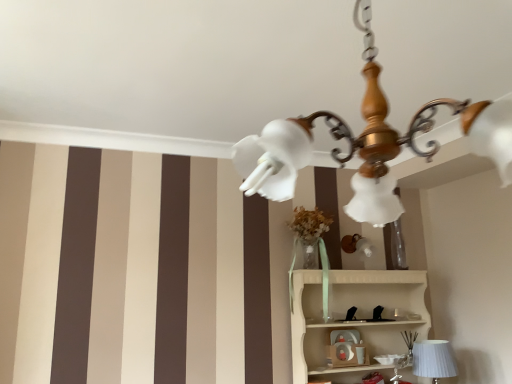
Locate an element on the screen. white ribbed fabric at lower right is located at coordinates (434, 359).

Where is `matte plastic toy at center`? matte plastic toy at center is located at coordinates (346, 349).

Image resolution: width=512 pixels, height=384 pixels. What do you see at coordinates (346, 349) in the screenshot? I see `matte plastic toy at center` at bounding box center [346, 349].

Measure the distance between point (362, 276) and camera.

Point (362, 276) and camera are 8.91 feet apart from each other.

The image size is (512, 384). Identify the location of white ribbed fabric at lower right. coord(434,359).

Consider the image. Is the surface of wooden chandelier at upper center in direct contact with white ribbed fabric at lower right?

No, wooden chandelier at upper center is not with white ribbed fabric at lower right.

Between wooden chandelier at upper center and white ribbed fabric at lower right, which one appears on the right side from the viewer's perspective?

white ribbed fabric at lower right is more to the right.

Is point (378, 142) closer to camera compared to point (422, 353)?

Yes, it is in front of point (422, 353).

Would you say wooden chandelier at upper center is outside white ribbed fabric at lower right?

Indeed, wooden chandelier at upper center is completely outside white ribbed fabric at lower right.

Locate an element on the screen. This screenshot has width=512, height=384. shelf on the right side of wooden chandelier at upper center is located at coordinates (357, 315).

From the image's perspective, is white wood shelf at lower right located beneath wooden chandelier at upper center?

Correct, white wood shelf at lower right appears lower than wooden chandelier at upper center in the image.

Is white wood shelf at lower right positioned beyond the bounds of wooden chandelier at upper center?

Absolutely, white wood shelf at lower right is external to wooden chandelier at upper center.

In terms of width, does white wood shelf at lower right look wider or thinner when compared to wooden chandelier at upper center?

Considering their sizes, white wood shelf at lower right looks slimmer than wooden chandelier at upper center.

Could you tell me if wooden chandelier at upper center is turned towards white wood shelf at lower right?

No, wooden chandelier at upper center does not turn towards white wood shelf at lower right.

Is wooden chandelier at upper center outside of white wood shelf at lower right?

Yes, wooden chandelier at upper center is not within white wood shelf at lower right.

From the image's perspective, which is above, wooden chandelier at upper center or white wood shelf at lower right?

wooden chandelier at upper center.

Between wooden chandelier at upper center and white wood shelf at lower right, which one has less height?

wooden chandelier at upper center is shorter.

Is white ribbed fabric at lower right turned away from white wood shelf at lower right?

Yes.

Does white ribbed fabric at lower right have a greater width compared to white wood shelf at lower right?

No, white ribbed fabric at lower right is not wider than white wood shelf at lower right.

From a real-world perspective, is white ribbed fabric at lower right above or below white wood shelf at lower right?

white ribbed fabric at lower right is below white wood shelf at lower right.

Based on the photo, between white ribbed fabric at lower right and white wood shelf at lower right, which one appears on the right side from the viewer's perspective?

white ribbed fabric at lower right.

Is white ribbed fabric at lower right taller than wooden chandelier at upper center?

No, white ribbed fabric at lower right is not taller than wooden chandelier at upper center.

Considering the relative positions of white ribbed fabric at lower right and wooden chandelier at upper center in the image provided, is white ribbed fabric at lower right to the left or to the right of wooden chandelier at upper center?

In the image, white ribbed fabric at lower right appears on the right side of wooden chandelier at upper center.

Do you think white ribbed fabric at lower right is within wooden chandelier at upper center, or outside of it?

white ribbed fabric at lower right is not inside wooden chandelier at upper center, it's outside.

The image size is (512, 384). Identify the location of lamp above the white ribbed fabric at lower right (from the image's perspective). (368, 142).

Considering the positions of objects matte plastic toy at center and white wood shelf at lower right in the image provided, who is more to the left, matte plastic toy at center or white wood shelf at lower right?

Positioned to the left is matte plastic toy at center.

Can you confirm if matte plastic toy at center is shorter than white wood shelf at lower right?

Correct, matte plastic toy at center is not as tall as white wood shelf at lower right.

From the image's perspective, is matte plastic toy at center above or below white wood shelf at lower right?

From the image's perspective, matte plastic toy at center appears below white wood shelf at lower right.

Which is closer to the camera, (370, 186) or (356, 332)?

Positioned in front is point (370, 186).

Considering the sizes of objects wooden chandelier at upper center and matte plastic toy at center in the image provided, who is taller, wooden chandelier at upper center or matte plastic toy at center?

With more height is wooden chandelier at upper center.

Could matte plastic toy at center be considered to be inside wooden chandelier at upper center?

Definitely not — matte plastic toy at center is not inside wooden chandelier at upper center.

From a real-world perspective, is wooden chandelier at upper center above or below matte plastic toy at center?

From a real-world perspective, wooden chandelier at upper center is physically above matte plastic toy at center.

You are a GUI agent. You are given a task and a screenshot of the screen. Output one action in this format:
    pyautogui.click(x=<x>, y=<y>)
    Task: Click on the lamp above the white ribbed fabric at lower right (from the image's perspective)
    
    Given the screenshot: What is the action you would take?
    pyautogui.click(x=368, y=142)

You are a GUI agent. You are given a task and a screenshot of the screen. Output one action in this format:
    pyautogui.click(x=<x>, y=<y>)
    Task: Click on the lamp in front of the white wood shelf at lower right
    
    Given the screenshot: What is the action you would take?
    pyautogui.click(x=368, y=142)

Considering their positions, is wooden chandelier at upper center positioned further to white ribbed fabric at lower right than matte plastic toy at center?

The object further to white ribbed fabric at lower right is wooden chandelier at upper center.

Considering their positions, is white wood shelf at lower right positioned further to wooden chandelier at upper center than white ribbed fabric at lower right?

The object further to wooden chandelier at upper center is white ribbed fabric at lower right.

When comparing their distances from white wood shelf at lower right, does matte plastic toy at center or white ribbed fabric at lower right seem closer?

matte plastic toy at center is closer to white wood shelf at lower right.

Considering their positions, is matte plastic toy at center positioned further to white wood shelf at lower right than wooden chandelier at upper center?

The object further to white wood shelf at lower right is wooden chandelier at upper center.

Considering their positions, is white ribbed fabric at lower right positioned further to wooden chandelier at upper center than matte plastic toy at center?

Based on the image, matte plastic toy at center appears to be further to wooden chandelier at upper center.

Estimate the real-world distances between objects in this image. Which object is closer to matte plastic toy at center, white wood shelf at lower right or white ribbed fabric at lower right?

The object closer to matte plastic toy at center is white wood shelf at lower right.

Estimate the real-world distances between objects in this image. Which object is further from wooden chandelier at upper center, matte plastic toy at center or white ribbed fabric at lower right?

The object further to wooden chandelier at upper center is matte plastic toy at center.

Estimate the real-world distances between objects in this image. Which object is further from matte plastic toy at center, white ribbed fabric at lower right or wooden chandelier at upper center?

wooden chandelier at upper center is positioned further to the anchor matte plastic toy at center.

Where is `table lamp located between wooden chandelier at upper center and matte plastic toy at center in the depth direction`? table lamp located between wooden chandelier at upper center and matte plastic toy at center in the depth direction is located at coordinates (434, 359).

Where is `shelf positioned between wooden chandelier at upper center and matte plastic toy at center from near to far`? This screenshot has width=512, height=384. shelf positioned between wooden chandelier at upper center and matte plastic toy at center from near to far is located at coordinates (357, 315).

Where is `shelf between wooden chandelier at upper center and white ribbed fabric at lower right in the front-back direction`? The image size is (512, 384). shelf between wooden chandelier at upper center and white ribbed fabric at lower right in the front-back direction is located at coordinates (357, 315).

At what (x,y) coordinates should I click in order to perform the action: click on shelf between matte plastic toy at center and white ribbed fabric at lower right. Please return your answer as a coordinate pair (x, y). The image size is (512, 384). Looking at the image, I should click on (357, 315).